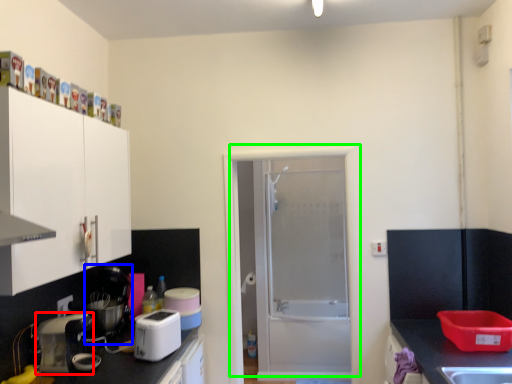
Question: Based on their relative distances, which object is farther from kitchen appliance (highlighted by a red box)? Choose from appliance (highlighted by a blue box) and door (highlighted by a green box).

Choices:
 (A) appliance
 (B) door

Answer: (B)